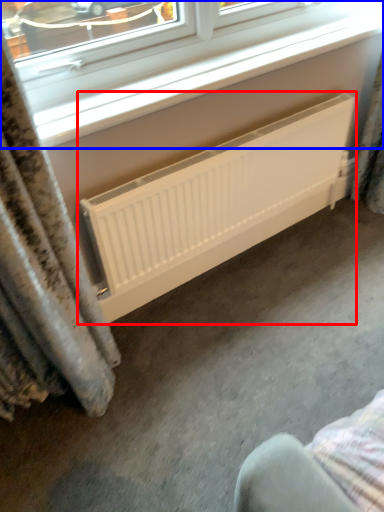
Question: Which object is closer to the camera taking this photo, radiator (highlighted by a red box) or window (highlighted by a blue box)?

Choices:
 (A) radiator
 (B) window

Answer: (B)